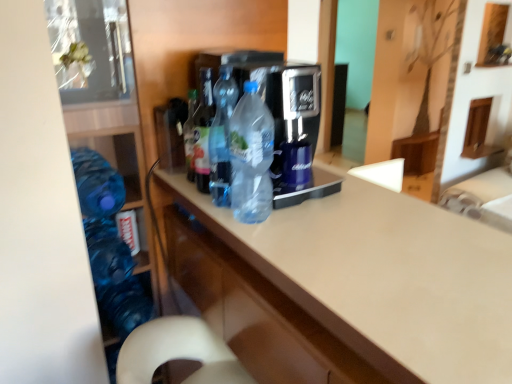
Find the location of a particular element. vacant point to the right of translucent plastic bottle at center, placed as the first bottle when sorted from right to left is located at coordinates (317, 216).